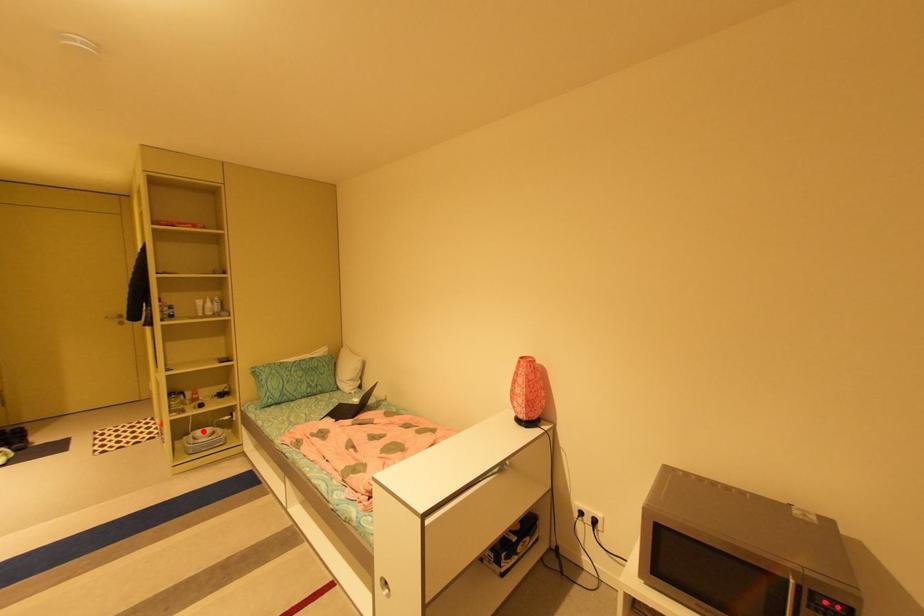
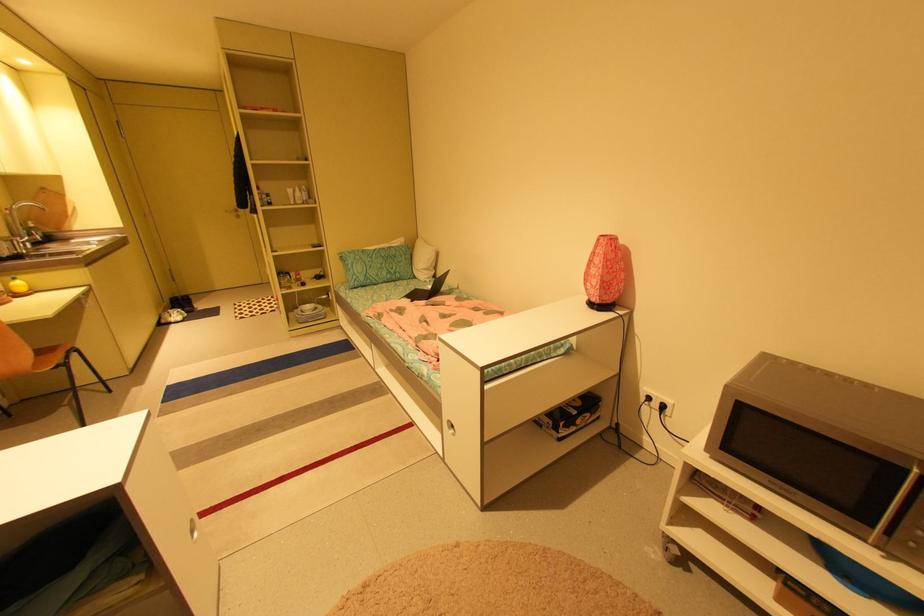
Question: I am providing you with two images of the same scene from different viewpoints. A red point is shown in image1. For the corresponding object point in image2, is it positioned nearer or farther from the camera?

Choices:
 (A) Nearer
 (B) Farther

Answer: (A)